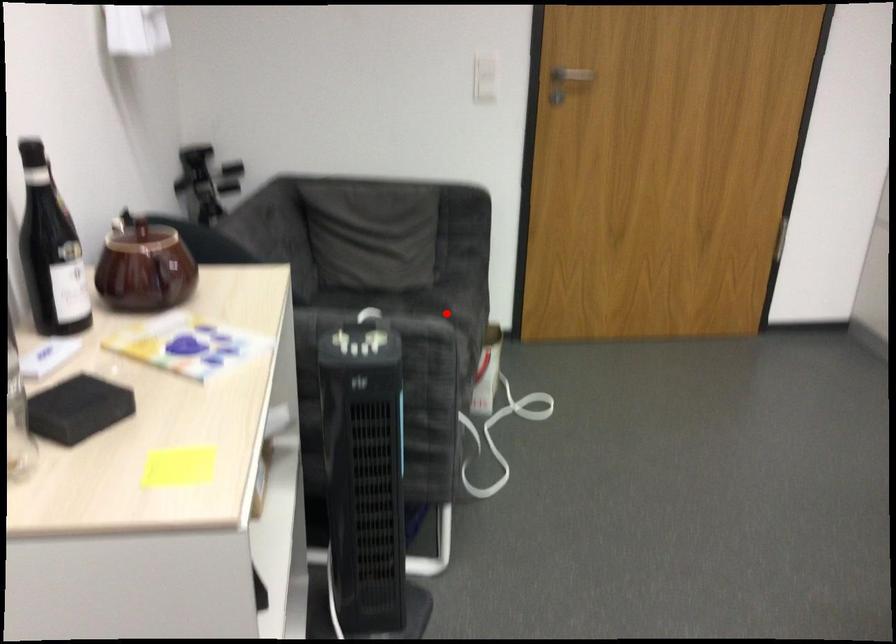
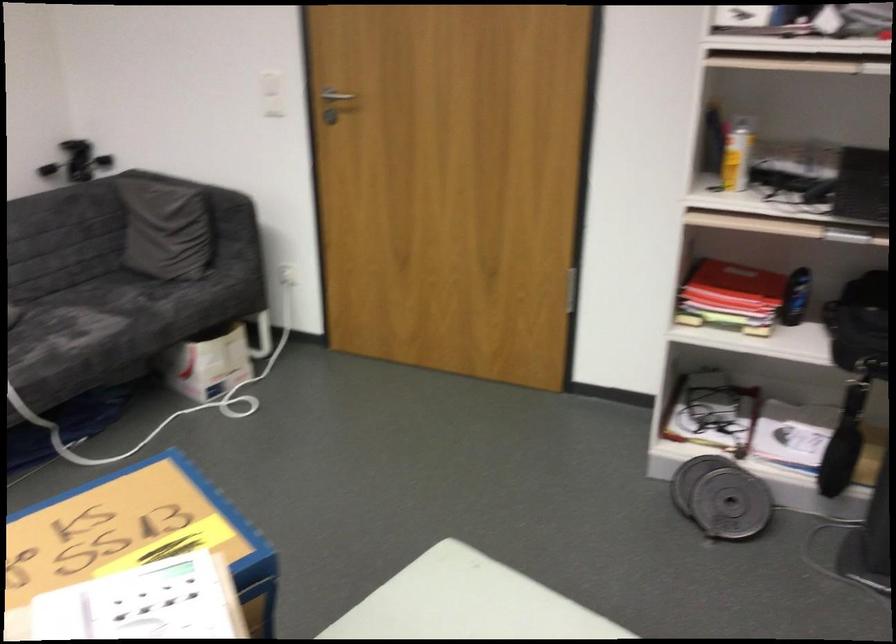
Find the pixel in the second image that matches the highlighted location in the first image.

(156, 306)